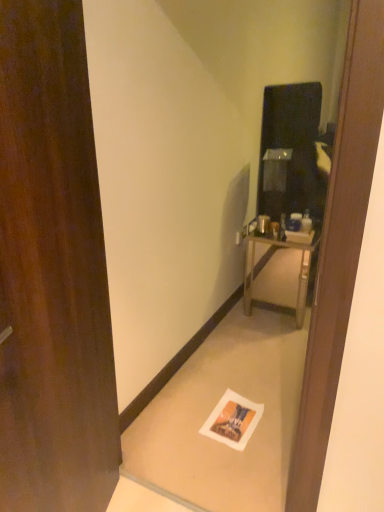
Where is `white paper at lower center`? This screenshot has height=512, width=384. white paper at lower center is located at coordinates (233, 420).

Which is more to the right, metallic silver nightstand at right or white paper at lower center?

Positioned to the right is metallic silver nightstand at right.

Where is `nightstand lying on the right of white paper at lower center`? nightstand lying on the right of white paper at lower center is located at coordinates (278, 274).

From the picture: Is metallic silver nightstand at right not near white paper at lower center?

Absolutely, metallic silver nightstand at right is distant from white paper at lower center.

Can you tell me how much metallic silver nightstand at right and white paper at lower center differ in facing direction?

The angle between the facing direction of metallic silver nightstand at right and the facing direction of white paper at lower center is 86.4 degrees.

Which object is more forward, brown wood door at left or metallic silver nightstand at right?

brown wood door at left is more forward.

From the image's perspective, between brown wood door at left and metallic silver nightstand at right, who is located below?

brown wood door at left appears lower in the image.

Considering the relative sizes of brown wood door at left and metallic silver nightstand at right in the image provided, is brown wood door at left taller than metallic silver nightstand at right?

Correct, brown wood door at left is much taller as metallic silver nightstand at right.

Considering the positions of objects brown wood door at left and metallic silver nightstand at right in the image provided, who is more to the right, brown wood door at left or metallic silver nightstand at right?

metallic silver nightstand at right is more to the right.

Considering the sizes of objects metallic silver nightstand at right and brown wood door at left in the image provided, who is smaller, metallic silver nightstand at right or brown wood door at left?

metallic silver nightstand at right is smaller.

From a real-world perspective, who is located higher, metallic silver nightstand at right or brown wood door at left?

brown wood door at left.

From the image's perspective, is metallic silver nightstand at right under brown wood door at left?

No, from the image's perspective, metallic silver nightstand at right is not beneath brown wood door at left.

Between metallic silver nightstand at right and brown wood door at left, which one is positioned behind?

metallic silver nightstand at right.

Is white paper at lower center spatially inside brown wood door at left, or outside of it?

white paper at lower center is spatially situated outside brown wood door at left.

Considering the relative positions of white paper at lower center and brown wood door at left in the image provided, is white paper at lower center to the left or to the right of brown wood door at left?

In the image, white paper at lower center appears on the right side of brown wood door at left.

Based on the photo, considering the relative positions of white paper at lower center and brown wood door at left in the image provided, is white paper at lower center in front of brown wood door at left?

No, it is behind brown wood door at left.

From the image's perspective, is white paper at lower center beneath brown wood door at left?

Yes.

Considering the sizes of objects white paper at lower center and metallic silver nightstand at right in the image provided, who is wider, white paper at lower center or metallic silver nightstand at right?

Wider between the two is metallic silver nightstand at right.

Considering the points (253, 415) and (301, 296), which point is behind, point (253, 415) or point (301, 296)?

Point (301, 296)

Who is smaller, white paper at lower center or metallic silver nightstand at right?

Smaller between the two is white paper at lower center.

Who is shorter, white paper at lower center or metallic silver nightstand at right?

white paper at lower center.

Based on the photo, is brown wood door at left placed right next to white paper at lower center?

No.

From the image's perspective, is brown wood door at left on white paper at lower center?

Correct, brown wood door at left appears higher than white paper at lower center in the image.

In the image, is brown wood door at left on the left side or the right side of white paper at lower center?

brown wood door at left is positioned on white paper at lower center's left side.

In terms of width, does brown wood door at left look wider or thinner when compared to white paper at lower center?

Clearly, brown wood door at left has less width compared to white paper at lower center.

In the image, there is a white paper at lower center. Identify the location of nightstand above it (from the image's perspective). Image resolution: width=384 pixels, height=512 pixels. (278, 274).

Identify the location of nightstand that appears behind the brown wood door at left. tap(278, 274).

Which object lies nearer to the anchor point white paper at lower center, brown wood door at left or metallic silver nightstand at right?

brown wood door at left is closer to white paper at lower center.

Consider the image. Based on their spatial positions, is metallic silver nightstand at right or brown wood door at left closer to white paper at lower center?

brown wood door at left lies closer to white paper at lower center than the other object.

Which object lies nearer to the anchor point metallic silver nightstand at right, white paper at lower center or brown wood door at left?

white paper at lower center lies closer to metallic silver nightstand at right than the other object.

Based on the photo, from the image, which object appears to be nearer to brown wood door at left, metallic silver nightstand at right or white paper at lower center?

white paper at lower center is positioned closer to the anchor brown wood door at left.

When comparing their distances from metallic silver nightstand at right, does brown wood door at left or white paper at lower center seem closer?

The object closer to metallic silver nightstand at right is white paper at lower center.

Which object lies nearer to the anchor point brown wood door at left, white paper at lower center or metallic silver nightstand at right?

white paper at lower center lies closer to brown wood door at left than the other object.

You are a GUI agent. You are given a task and a screenshot of the screen. Output one action in this format:
    pyautogui.click(x=<x>, y=<y>)
    Task: Click on the postcard between brown wood door at left and metallic silver nightstand at right in the front-back direction
    Image resolution: width=384 pixels, height=512 pixels.
    Given the screenshot: What is the action you would take?
    [x=233, y=420]